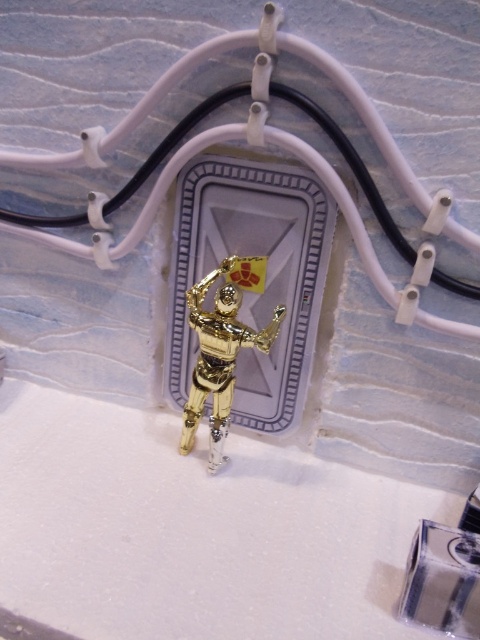
Question: Does black rubber wire at center have a lesser width compared to gold metallic robot at center?

Choices:
 (A) no
 (B) yes

Answer: (A)

Question: Which point is closer to the camera?

Choices:
 (A) gold metallic robot at center
 (B) black rubber wire at center

Answer: (B)

Question: Which point is farther to the camera?

Choices:
 (A) (97, 257)
 (B) (201, 358)

Answer: (A)

Question: Does black rubber wire at center have a lesser width compared to gold metallic robot at center?

Choices:
 (A) no
 (B) yes

Answer: (A)

Question: Is black rubber wire at center bigger than gold metallic robot at center?

Choices:
 (A) yes
 (B) no

Answer: (A)